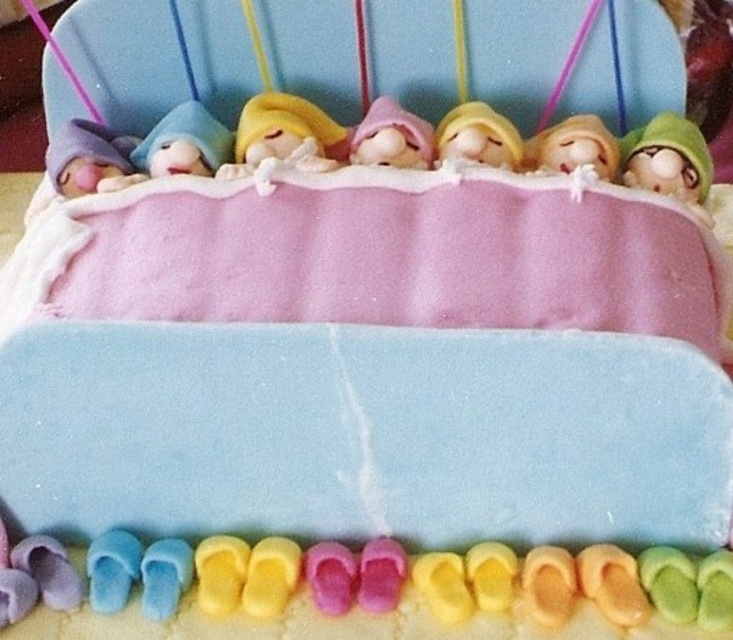
Who is higher up, matte purple doll at left or pink fondant baby at center?

Positioned higher is pink fondant baby at center.

Does matte purple doll at left have a lesser height compared to pink fondant baby at center?

In fact, matte purple doll at left may be taller than pink fondant baby at center.

Between point (48, 163) and point (394, 129), which one is positioned in front?

Positioned in front is point (394, 129).

The image size is (733, 640). I want to click on matte purple doll at left, so click(86, 157).

Is green matte toy at right positioned in front of yellow felt baby at center?

That is True.

Who is more distant from viewer, (641, 156) or (276, 147)?

The point (276, 147) is behind.

I want to click on green matte toy at right, so click(x=666, y=160).

From the picture: Can you confirm if yellow felt baby at center is positioned below matte pink doll at center?

No.

Does yellow felt baby at center have a greater width compared to matte pink doll at center?

Yes.

Identify the location of yellow felt baby at center. (284, 131).

I want to click on yellow felt baby at center, so click(x=284, y=131).